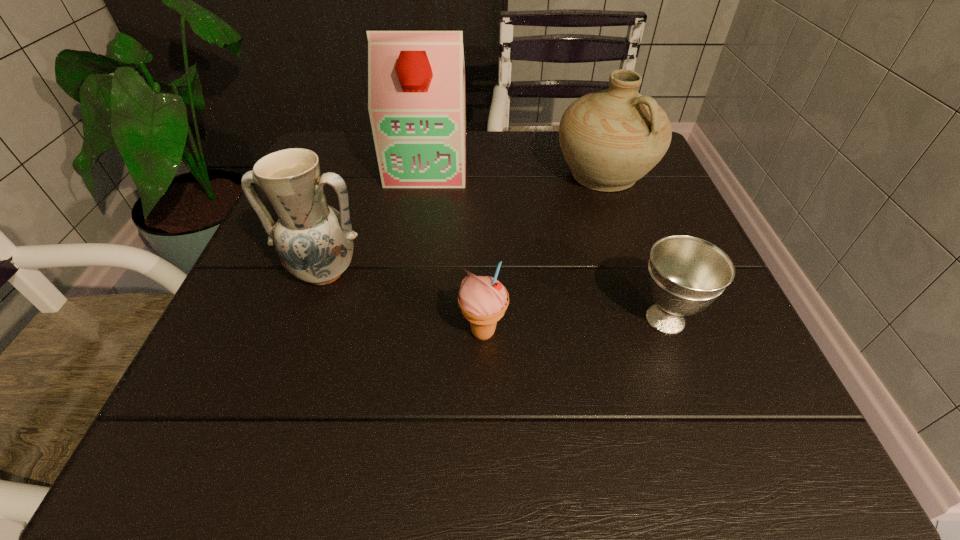
Locate an element on the screen. The image size is (960, 540). blank space at the far left corner of the desktop is located at coordinates (331, 160).

Identify the location of unoccupied position between the tallest object and the icecream. The image size is (960, 540). (455, 249).

Where is `vacant area that lies between the icecream and the chalice`? Image resolution: width=960 pixels, height=540 pixels. vacant area that lies between the icecream and the chalice is located at coordinates pyautogui.click(x=574, y=326).

Where is `empty location between the icecream and the chalice`? empty location between the icecream and the chalice is located at coordinates coord(574,326).

Locate an element on the screen. This screenshot has width=960, height=540. free area in between the tallest object and the right pottery is located at coordinates (516, 170).

Identify the location of free space between the soya milk and the right pottery. Image resolution: width=960 pixels, height=540 pixels. (516, 170).

You are a GUI agent. You are given a task and a screenshot of the screen. Output one action in this format:
    pyautogui.click(x=<x>, y=<y>)
    Task: Click on the free area in between the right pottery and the third object from left to right
    The height and width of the screenshot is (540, 960).
    Given the screenshot: What is the action you would take?
    [x=543, y=254]

Where is `vacant space in between the third object from right to left and the soya milk`? The image size is (960, 540). vacant space in between the third object from right to left and the soya milk is located at coordinates (455, 249).

Where is `unoccupied position between the icecream and the soya milk`? This screenshot has height=540, width=960. unoccupied position between the icecream and the soya milk is located at coordinates (455, 249).

Image resolution: width=960 pixels, height=540 pixels. Identify the location of the third closest object relative to the tallest object. (483, 300).